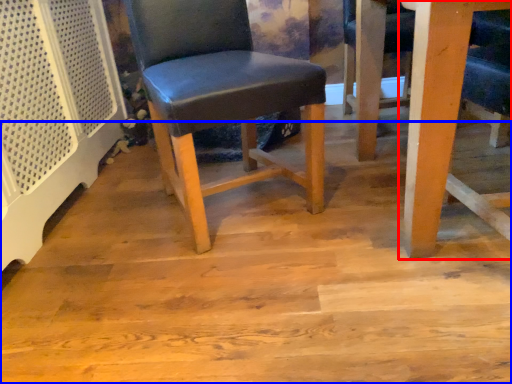
Question: Which of the following is the farthest to the observer, table (highlighted by a red box) or plywood (highlighted by a blue box)?

Choices:
 (A) table
 (B) plywood

Answer: (B)